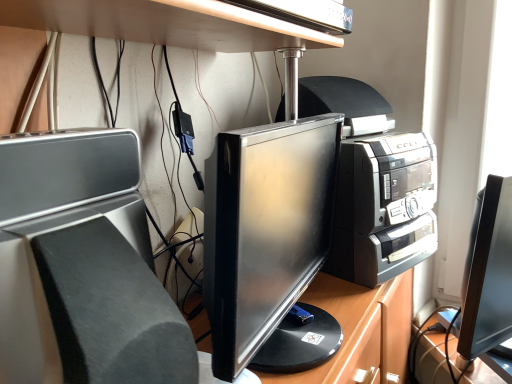
Question: Does satin silver speaker at left have a smaller size compared to metallic silver desk at upper center?

Choices:
 (A) no
 (B) yes

Answer: (A)

Question: Is satin silver speaker at left to the right of metallic silver desk at upper center from the viewer's perspective?

Choices:
 (A) no
 (B) yes

Answer: (A)

Question: Is satin silver speaker at left oriented towards metallic silver desk at upper center?

Choices:
 (A) no
 (B) yes

Answer: (A)

Question: Is satin silver speaker at left positioned far away from metallic silver desk at upper center?

Choices:
 (A) no
 (B) yes

Answer: (A)

Question: Can you confirm if satin silver speaker at left is wider than metallic silver desk at upper center?

Choices:
 (A) no
 (B) yes

Answer: (B)

Question: Can you confirm if satin silver speaker at left is bigger than metallic silver desk at upper center?

Choices:
 (A) no
 (B) yes

Answer: (B)

Question: Is metallic silver desk at upper center completely or partially outside of satin silver speaker at left?

Choices:
 (A) no
 (B) yes

Answer: (B)

Question: Is metallic silver desk at upper center facing towards satin silver speaker at left?

Choices:
 (A) yes
 (B) no

Answer: (B)

Question: Does metallic silver desk at upper center appear on the right side of satin silver speaker at left?

Choices:
 (A) no
 (B) yes

Answer: (B)

Question: From the image's perspective, is metallic silver desk at upper center beneath satin silver speaker at left?

Choices:
 (A) yes
 (B) no

Answer: (B)

Question: Considering the relative sizes of metallic silver desk at upper center and satin silver speaker at left in the image provided, is metallic silver desk at upper center shorter than satin silver speaker at left?

Choices:
 (A) no
 (B) yes

Answer: (B)

Question: Does metallic silver desk at upper center have a greater height compared to satin silver speaker at left?

Choices:
 (A) no
 (B) yes

Answer: (A)

Question: In the image, is metallic silver desk at upper center positioned in front of or behind satin silver speaker at left?

Choices:
 (A) front
 (B) behind

Answer: (B)